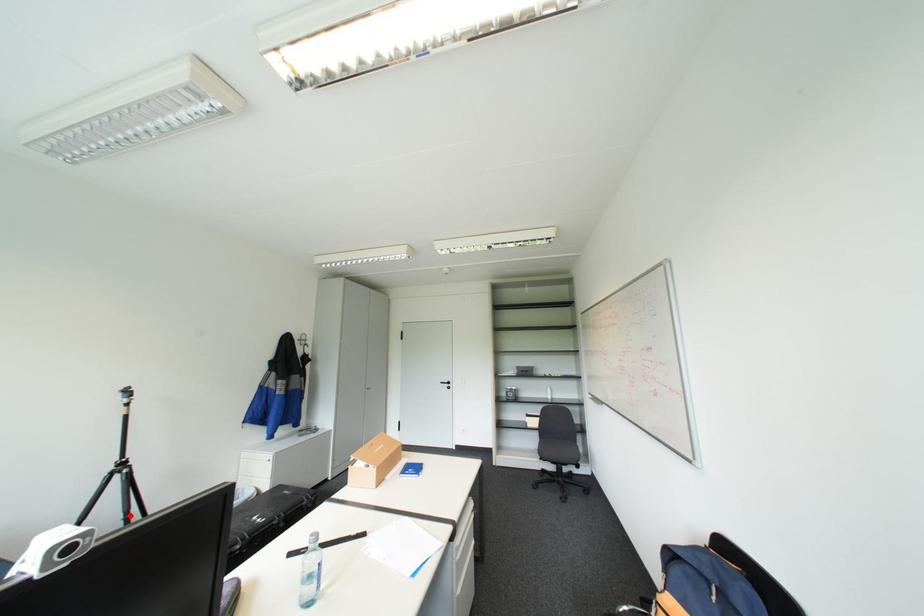
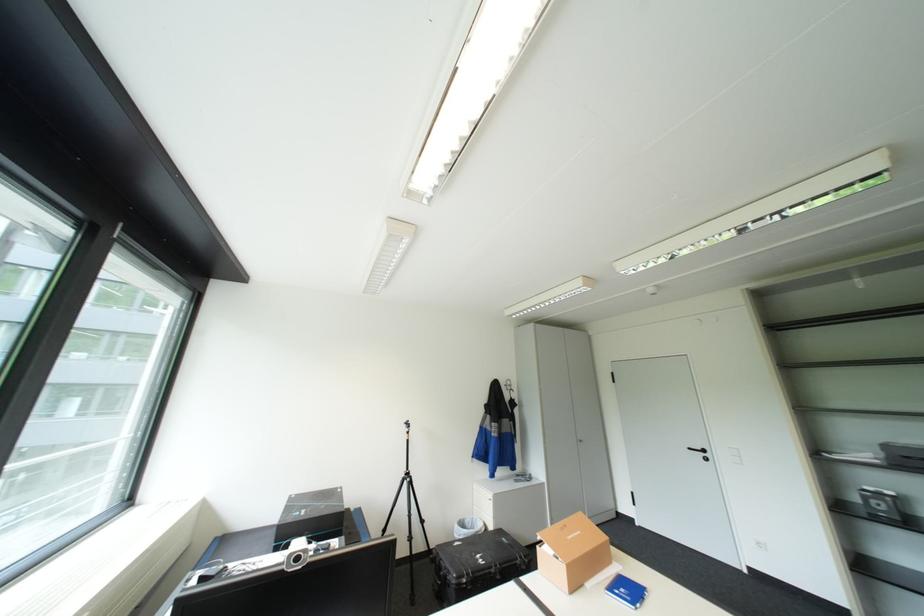
Question: I am providing you with two images of the same scene from different viewpoints. Given a red point in image1, look at the same physical point in image2. Is it:

Choices:
 (A) Closer to the viewpoint
 (B) Farther from the viewpoint

Answer: (A)